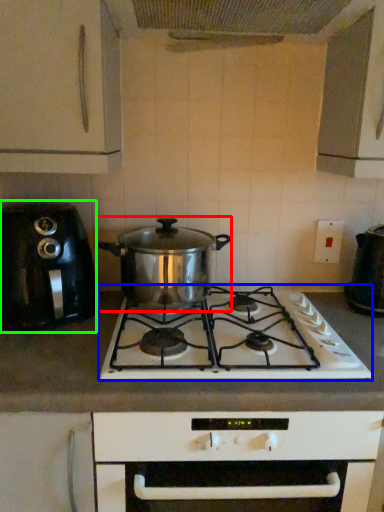
Question: Considering the real-world distances, which object is farthest from slow cooker (highlighted by a red box)? gas stove (highlighted by a blue box) or kitchen appliance (highlighted by a green box)?

Choices:
 (A) gas stove
 (B) kitchen appliance

Answer: (B)